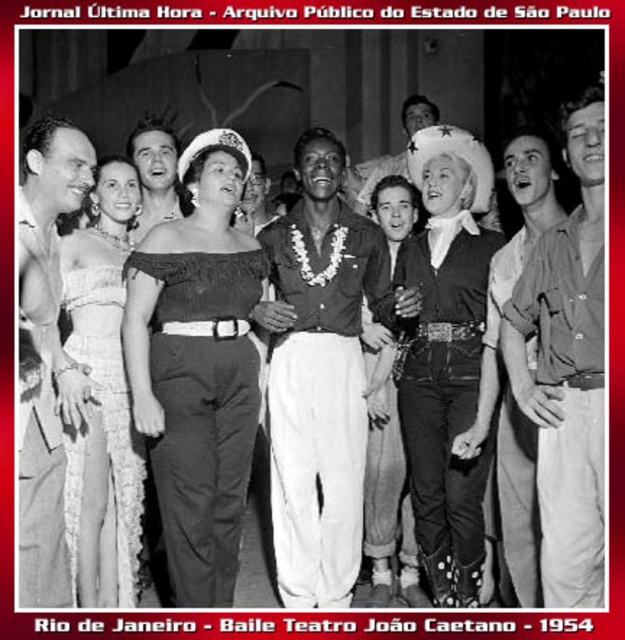
Question: Which object is farther from the camera taking this photo?

Choices:
 (A) smooth skin shirt at left
 (B) smooth leather jacket at center
 (C) black satin dress at center

Answer: (B)

Question: Which point appears farthest from the camera in this image?

Choices:
 (A) (341, 604)
 (B) (429, 420)
 (C) (432, 120)
 (D) (65, 573)

Answer: (C)

Question: Is lace fabric dress at left positioned behind smooth skin face at center?

Choices:
 (A) yes
 (B) no

Answer: (B)

Question: Is smooth brown leather jacket at center to the left of smooth leather jacket at center from the viewer's perspective?

Choices:
 (A) no
 (B) yes

Answer: (B)

Question: Which object appears closest to the camera in this image?

Choices:
 (A) smooth leather jacket at center
 (B) black satin dress at center
 (C) smooth brown leather jacket at center
 (D) light brown cotton shirt at center

Answer: (D)

Question: Does smooth brown leather jacket at center appear on the left side of lace fabric dress at left?

Choices:
 (A) no
 (B) yes

Answer: (A)